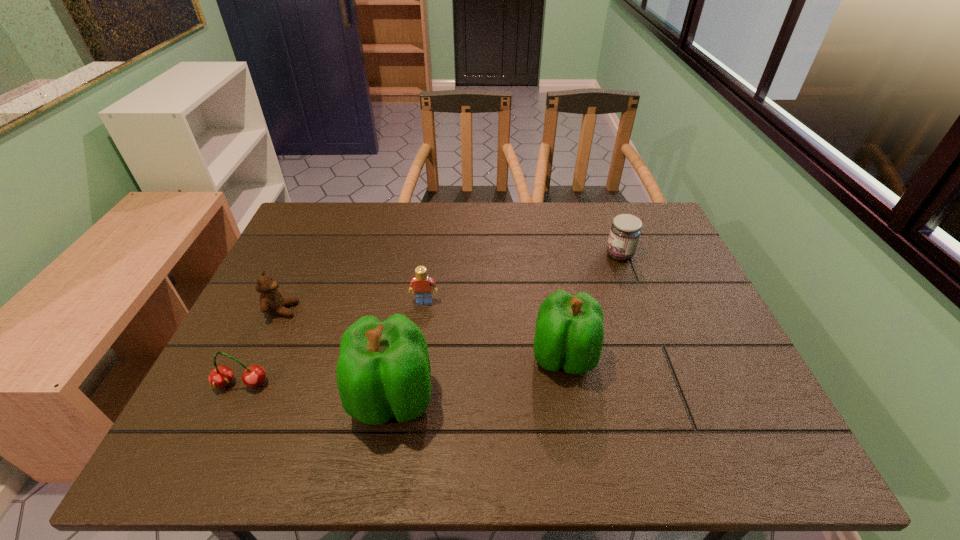
Find the location of a particular element. free point between the rightmost object and the Lego is located at coordinates 522,278.

Find the location of `free space that is in between the teddy bear and the jam`. free space that is in between the teddy bear and the jam is located at coordinates (451, 282).

This screenshot has width=960, height=540. Identify the location of vacant space that is in between the Lego and the rightmost object. tap(522, 278).

Identify the location of empty space that is in between the left bell pepper and the fifth object from left to right. The width and height of the screenshot is (960, 540). (478, 379).

This screenshot has width=960, height=540. Find the location of `free space between the tallest object and the right bell pepper`. free space between the tallest object and the right bell pepper is located at coordinates (478, 379).

Where is `free area in between the cherry and the Lego`? The width and height of the screenshot is (960, 540). free area in between the cherry and the Lego is located at coordinates point(333,343).

This screenshot has height=540, width=960. In order to click on vacant space that is in between the teddy bear and the farthest object in this screenshot , I will do `click(451, 282)`.

At what (x,y) coordinates should I click in order to perform the action: click on blank region between the teddy bear and the Lego. Please return your answer as a coordinate pair (x, y). The height and width of the screenshot is (540, 960). Looking at the image, I should click on (353, 306).

Where is `object that is the second closest one to the rightmost object`? object that is the second closest one to the rightmost object is located at coordinates (421, 284).

The width and height of the screenshot is (960, 540). Identify the location of the fifth closest object to the Lego. (625, 231).